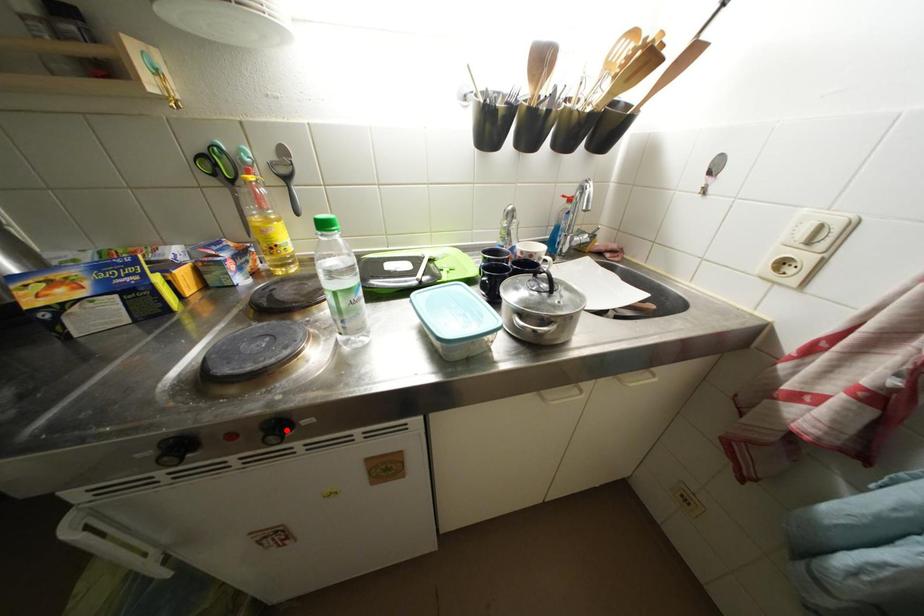
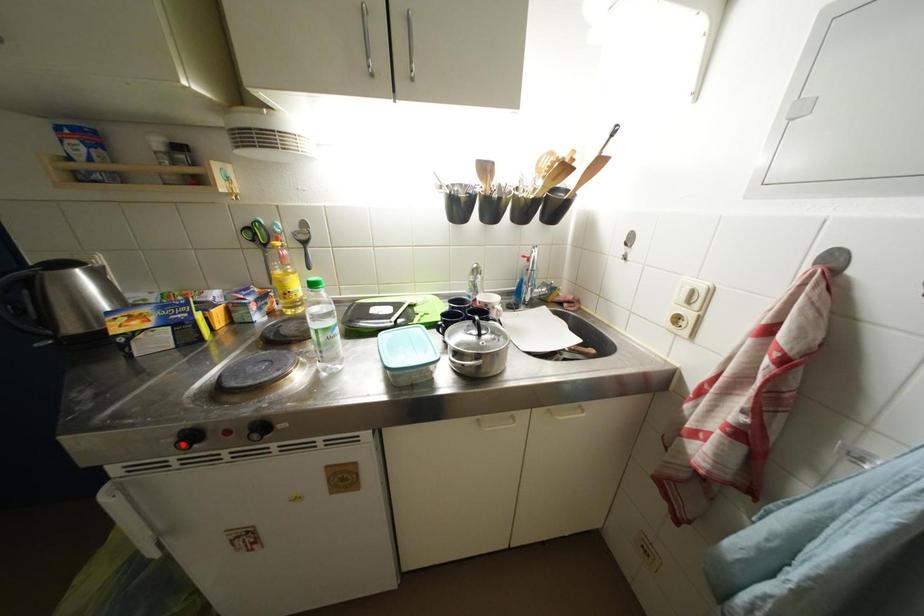
I am providing you with two images of the same scene from different viewpoints. A red point is marked on the first image and another point is marked on the second image. Do the highlighted points in image1 and image2 indicate the same real-world spot?

No